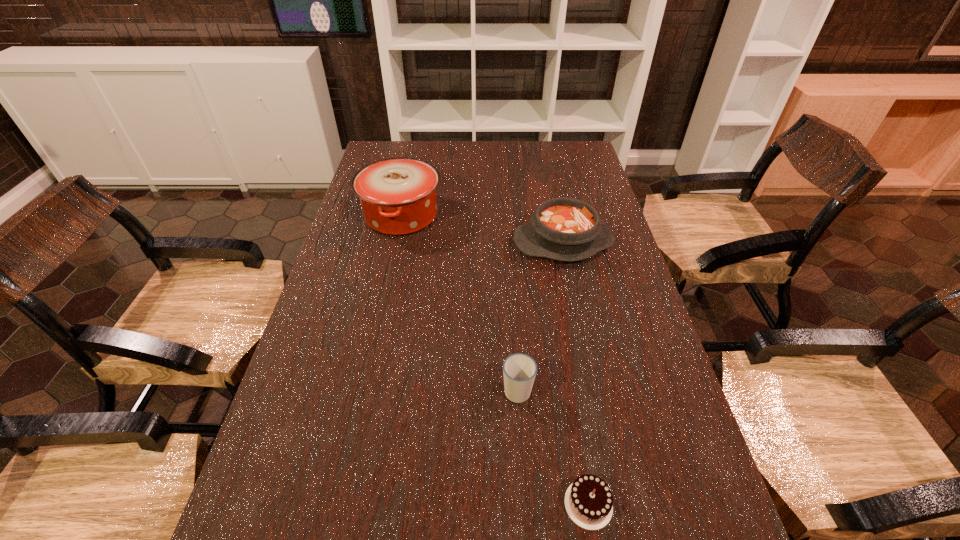
You are a GUI agent. You are given a task and a screenshot of the screen. Output one action in this format:
    pyautogui.click(x=<x>, y=<y>)
    Task: Click on the vacant area that satisfies the following two spatial constraints: 1. on the back side of the nearest object; 2. on the left side of the right casserole
    The height and width of the screenshot is (540, 960).
    Given the screenshot: What is the action you would take?
    pyautogui.click(x=545, y=242)

Locate an element on the screen. vacant space that satisfies the following two spatial constraints: 1. with a handle on the side of the second nearest object; 2. on the left side of the right casserole is located at coordinates (507, 242).

Where is `vacant region that satisfies the following two spatial constraints: 1. with a handle on the side of the shorter casserole; 2. on the left side of the cup`? The height and width of the screenshot is (540, 960). vacant region that satisfies the following two spatial constraints: 1. with a handle on the side of the shorter casserole; 2. on the left side of the cup is located at coordinates (507, 242).

The image size is (960, 540). In order to click on vacant space that satisfies the following two spatial constraints: 1. with a handle on the side of the cup; 2. on the right side of the right casserole in this screenshot , I will do `click(507, 242)`.

Image resolution: width=960 pixels, height=540 pixels. I want to click on free space that satisfies the following two spatial constraints: 1. with a handle on the side of the right casserole; 2. on the right side of the second nearest object, so click(507, 242).